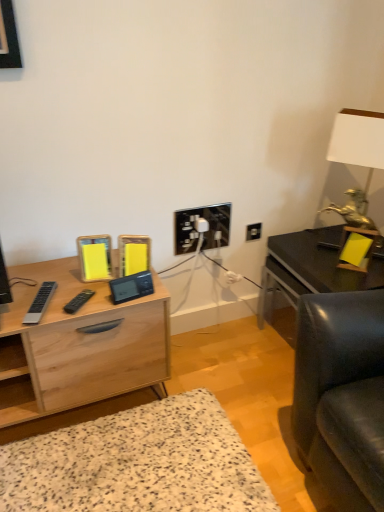
The image size is (384, 512). What do you see at coordinates (253, 231) in the screenshot? I see `black plastic electric outlet at center` at bounding box center [253, 231].

The image size is (384, 512). Find the location of `light wood desk at center`. light wood desk at center is located at coordinates (78, 345).

Image resolution: width=384 pixels, height=512 pixels. I want to click on white matte table lamp at upper right, so click(x=358, y=141).

Looking at this image, from the image's perspective, is light wood desk at center beneath matte black table at right?

Yes.

Is light wood desk at center beside matte black table at right?

No, light wood desk at center is not beside matte black table at right.

Can you confirm if light wood desk at center is positioned to the right of matte black table at right?

In fact, light wood desk at center is to the left of matte black table at right.

Could white matte table lamp at upper right be considered to be inside black plastic electric outlet at center?

No, white matte table lamp at upper right is not inside black plastic electric outlet at center.

Which object is positioned more to the right, black plastic electric outlet at center or white matte table lamp at upper right?

white matte table lamp at upper right.

Which object is closer to the camera, black plastic electric outlet at center or white matte table lamp at upper right?

white matte table lamp at upper right is more forward.

Is light wood desk at center outside of white matte table lamp at upper right?

light wood desk at center lies outside white matte table lamp at upper right's area.

From the image's perspective, is light wood desk at center located above white matte table lamp at upper right?

Incorrect, from the image's perspective, light wood desk at center is lower than white matte table lamp at upper right.

Is light wood desk at center taller than white matte table lamp at upper right?

No.

From the image's perspective, is matte black table at right located beneath white matte table lamp at upper right?

Correct, matte black table at right appears lower than white matte table lamp at upper right in the image.

Is matte black table at right positioned before white matte table lamp at upper right?

No, it is behind white matte table lamp at upper right.

Consider the image. Considering the positions of objects matte black table at right and white matte table lamp at upper right in the image provided, who is more to the right, matte black table at right or white matte table lamp at upper right?

From the viewer's perspective, white matte table lamp at upper right appears more on the right side.

Is white matte table lamp at upper right to the left or to the right of light wood desk at center in the image?

Based on their positions, white matte table lamp at upper right is located to the right of light wood desk at center.

Which of these two, white matte table lamp at upper right or light wood desk at center, is bigger?

light wood desk at center is bigger.

Which point is more distant from viewer, (371, 159) or (51, 400)?

Positioned behind is point (371, 159).

Is white matte table lamp at upper right shorter than light wood desk at center?

Incorrect, the height of white matte table lamp at upper right does not fall short of that of light wood desk at center.

Relative to black plastic electric outlet at center, is light wood desk at center in front or behind?

Clearly, light wood desk at center is in front of black plastic electric outlet at center.

Is light wood desk at center looking in the opposite direction of black plastic electric outlet at center?

That's not correct — light wood desk at center is not looking away from black plastic electric outlet at center.

From the image's perspective, which one is positioned lower, light wood desk at center or black plastic electric outlet at center?

light wood desk at center is shown below in the image.

From a real-world perspective, which object stands above the other?

In real-world perspective, black plastic electric outlet at center is above.

Could black plastic electric outlet at center be considered to be inside matte black table at right?

No, black plastic electric outlet at center is not inside matte black table at right.

The height and width of the screenshot is (512, 384). In order to click on electric outlet on the left of the matte black table at right in this screenshot , I will do `click(253, 231)`.

Which of these two, matte black table at right or black plastic electric outlet at center, stands taller?

matte black table at right is taller.

Can you confirm if matte black table at right is bigger than black plastic electric outlet at center?

Yes.

Identify the location of desk in front of the matte black table at right. (78, 345).

Where is `electric outlet behind the white matte table lamp at upper right`? electric outlet behind the white matte table lamp at upper right is located at coordinates (253, 231).

Which object lies nearer to the anchor point white matte table lamp at upper right, matte black table at right or black plastic electric outlet at center?

Based on the image, matte black table at right appears to be nearer to white matte table lamp at upper right.

Estimate the real-world distances between objects in this image. Which object is closer to black plastic electric outlet at center, white matte table lamp at upper right or light wood desk at center?

Among the two, white matte table lamp at upper right is located nearer to black plastic electric outlet at center.

Which object lies further to the anchor point white matte table lamp at upper right, light wood desk at center or matte black table at right?

The object further to white matte table lamp at upper right is light wood desk at center.

Based on the photo, estimate the real-world distances between objects in this image. Which object is closer to black plastic electric outlet at center, light wood desk at center or white matte table lamp at upper right?

The object closer to black plastic electric outlet at center is white matte table lamp at upper right.

Estimate the real-world distances between objects in this image. Which object is further from light wood desk at center, matte black table at right or white matte table lamp at upper right?

Among the two, white matte table lamp at upper right is located further to light wood desk at center.

Looking at this image, considering their positions, is black plastic electric outlet at center positioned closer to light wood desk at center than matte black table at right?

Based on the image, matte black table at right appears to be nearer to light wood desk at center.

Which object lies further to the anchor point light wood desk at center, white matte table lamp at upper right or black plastic electric outlet at center?

white matte table lamp at upper right is further to light wood desk at center.

Considering their positions, is white matte table lamp at upper right positioned closer to black plastic electric outlet at center than matte black table at right?

The object closer to black plastic electric outlet at center is matte black table at right.

At what (x,y) coordinates should I click in order to perform the action: click on table between light wood desk at center and white matte table lamp at upper right in the horizontal direction. Please return your answer as a coordinate pair (x, y). The width and height of the screenshot is (384, 512). Looking at the image, I should click on (311, 267).

Find the location of a particular element. This screenshot has width=384, height=512. table between white matte table lamp at upper right and black plastic electric outlet at center in the front-back direction is located at coordinates (x=311, y=267).

Locate an element on the screen. This screenshot has width=384, height=512. electric outlet between light wood desk at center and matte black table at right is located at coordinates (253, 231).

Locate an element on the screen. This screenshot has width=384, height=512. electric outlet between light wood desk at center and white matte table lamp at upper right in the horizontal direction is located at coordinates (253, 231).